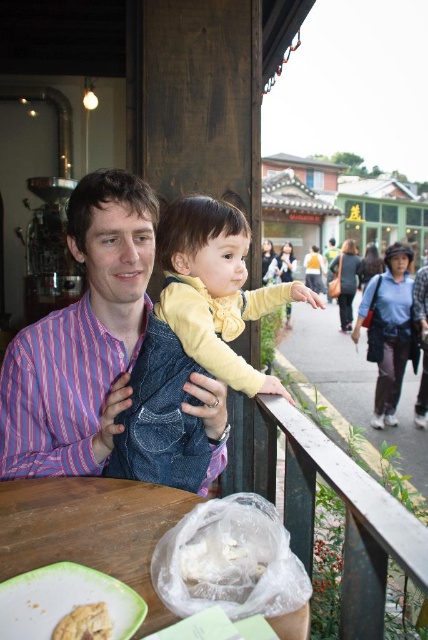
You are a photographer standing in front of the wooden table at lower left and the denim vest at center. You want to take a photo of the scene. Which object should you focus on first if you want to capture the subject closest to the camera?

The denim vest at center is closer to the camera than the wooden table at lower left, so you should focus on the denim vest at center first.